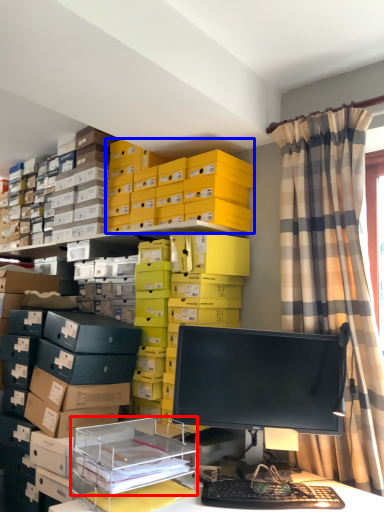
Question: Among these objects, which one is farthest to the camera, shelf (highlighted by a red box) or storage box (highlighted by a blue box)?

Choices:
 (A) shelf
 (B) storage box

Answer: (B)